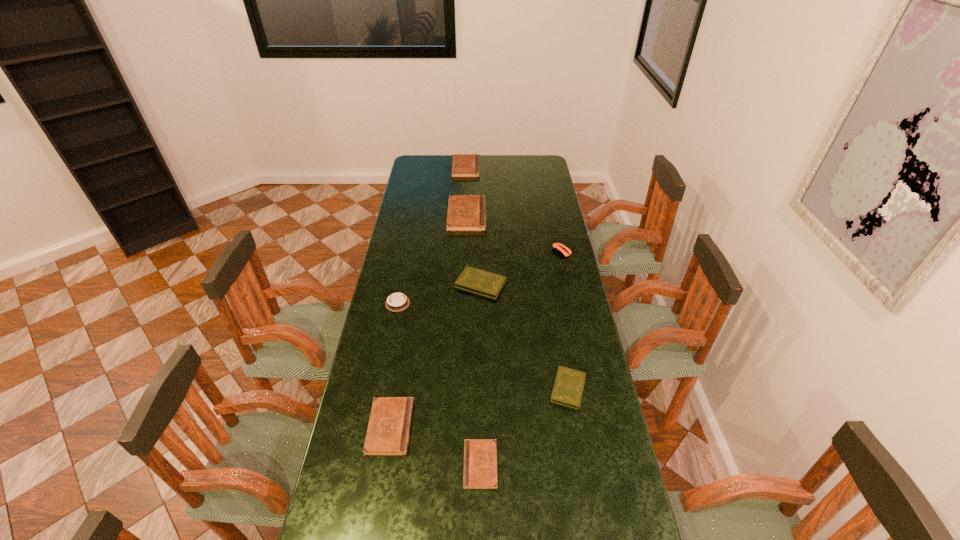
At what (x,y) coordinates should I click in order to perform the action: click on free point located 0.350m on the front of the rightmost diary. Please return your answer as a coordinate pair (x, y). This screenshot has width=960, height=540. Looking at the image, I should click on click(593, 534).

The width and height of the screenshot is (960, 540). Find the location of `vacant space located 0.310m on the spine side of the smallest brown diary`. vacant space located 0.310m on the spine side of the smallest brown diary is located at coordinates (354, 465).

The width and height of the screenshot is (960, 540). Find the location of `free space located on the spine side of the smallest brown diary`. free space located on the spine side of the smallest brown diary is located at coordinates (432, 465).

The image size is (960, 540). I want to click on free space located on the spine side of the smallest brown diary, so click(336, 465).

Identify the location of object that is at the far edge. The image size is (960, 540). (464, 165).

The height and width of the screenshot is (540, 960). Identify the location of chocolate cake present at the left edge. (398, 301).

Locate an element on the screen. Image resolution: width=960 pixels, height=540 pixels. diary situated at the left edge is located at coordinates (388, 432).

Where is `computer mouse positioned at the right edge`? computer mouse positioned at the right edge is located at coordinates (559, 248).

At what (x,y) coordinates should I click in order to perform the action: click on diary located at the right edge. Please return your answer as a coordinate pair (x, y). This screenshot has width=960, height=540. Looking at the image, I should click on (568, 388).

The height and width of the screenshot is (540, 960). Identify the location of free location at the far edge. (442, 156).